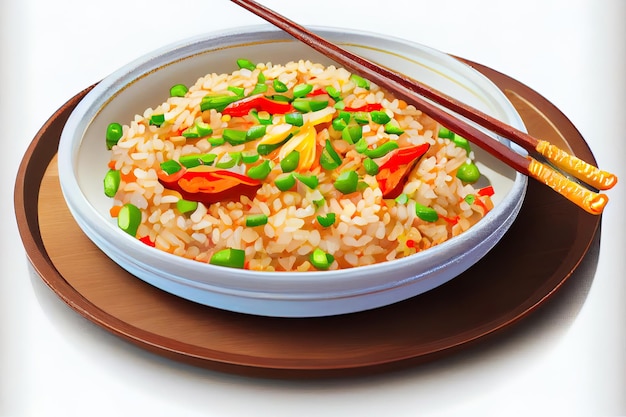
Where is `gold line along inside of white dish`? gold line along inside of white dish is located at coordinates coord(228,48).